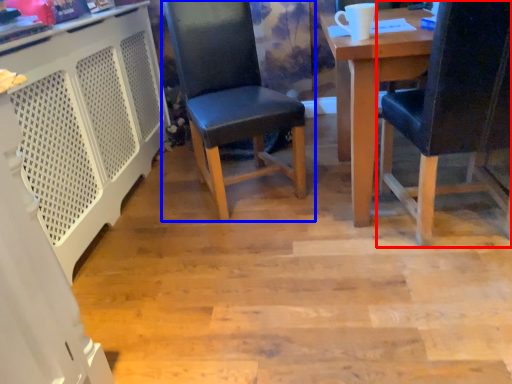
Question: Among these objects, which one is farthest to the camera, chair (highlighted by a red box) or chair (highlighted by a blue box)?

Choices:
 (A) chair
 (B) chair

Answer: (B)